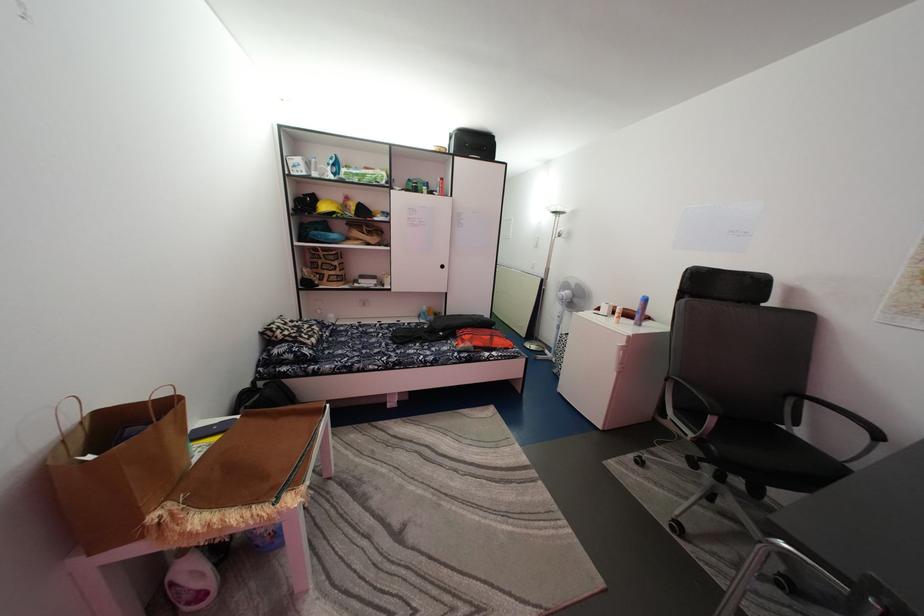
This screenshot has height=616, width=924. Describe the element at coordinates (103, 415) in the screenshot. I see `a brown paper bag handle` at that location.